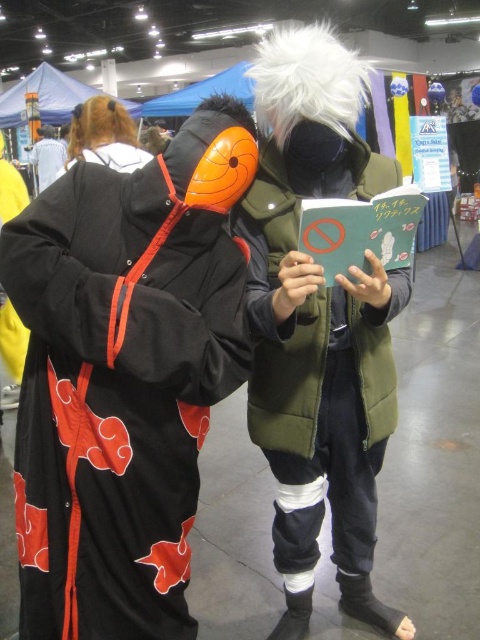
You are a photographer at the convention and need to frame a shot that includes both the black fabric cloak at left and the matte green vest at center. Which object should you adjust your camera angle to focus on first to ensure both are in the frame?

The black fabric cloak at left has a smaller size compared to matte green vest at center, so you should focus on the larger matte green vest at center first to ensure both fit within the frame.

You are a photographer at the convention and need to take a photo of the black fabric cloak at left and the camera. Are they close enough to be in the same frame without moving either? The camera has a 50mm lens and the minimum focusing distance is 1.5 feet. The maximum distance between objects in the frame can be up to 4 feet.

The black fabric cloak at left and camera are 3.58 feet apart. Since the maximum distance between objects in the frame is 4 feet, they can be captured in the same frame without moving either.

You are a photographer at the convention and want to take a photo of both the black fabric cloak at left and the individual on the right. Since you can only focus on one subject at a time, which one should you focus on to ensure the other is still in the background?

You should focus on the individual on the right because the black fabric cloak at left is located at point (124, 376), which is closer to the camera, so focusing on the farther subject would keep both in focus.